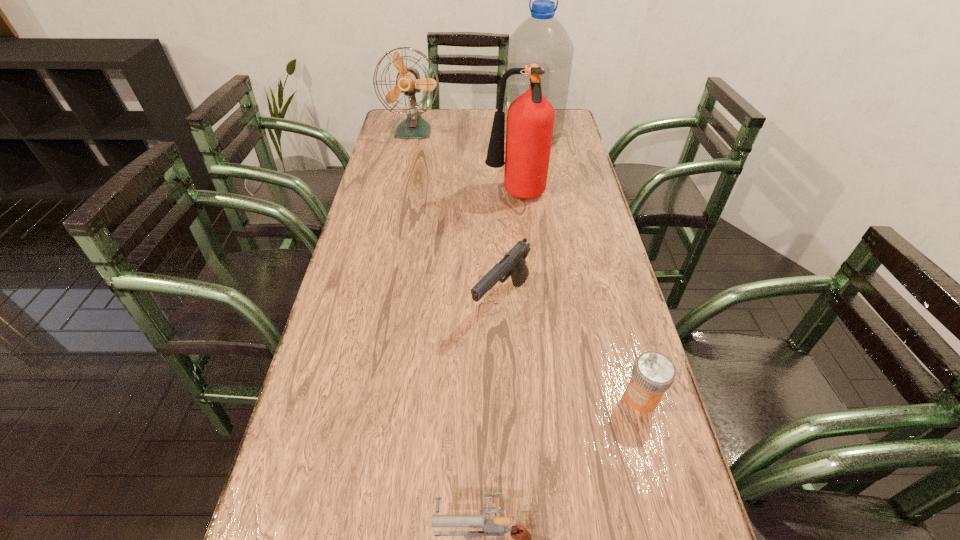
Locate an element on the screen. This screenshot has height=540, width=960. vacant position located 0.390m at the nozzle of the second tallest object is located at coordinates (366, 197).

Locate an element on the screen. free spot located 0.060m at the nozzle of the second tallest object is located at coordinates (467, 197).

You are a GUI agent. You are given a task and a screenshot of the screen. Output one action in this format:
    pyautogui.click(x=<x>, y=<y>)
    Task: Click on the free space located 0.390m on the front-facing side of the fourth shortest object for air flow
    This screenshot has height=540, width=960.
    Given the screenshot: What is the action you would take?
    pyautogui.click(x=397, y=207)

Find the location of `free space located at the muzzle of the third nearest object`. free space located at the muzzle of the third nearest object is located at coordinates coord(505,372).

Where is `vacant space located 0.200m on the label side of the fifth farthest object`? Image resolution: width=960 pixels, height=540 pixels. vacant space located 0.200m on the label side of the fifth farthest object is located at coordinates (530, 397).

In order to click on free space located 0.330m on the label side of the fifth farthest object in this screenshot , I will do `click(469, 397)`.

At what (x,y) coordinates should I click in order to perform the action: click on vacant point located 0.060m on the label side of the fifth farthest object. Please return your answer as a coordinate pair (x, y). The height and width of the screenshot is (540, 960). Looking at the image, I should click on (595, 397).

What are the coordinates of `water jug situated at the far edge` in the screenshot? It's located at (541, 39).

Where is `fan at the far edge`? This screenshot has width=960, height=540. fan at the far edge is located at coordinates (408, 81).

What are the coordinates of `object that is at the left edge` in the screenshot? It's located at (408, 81).